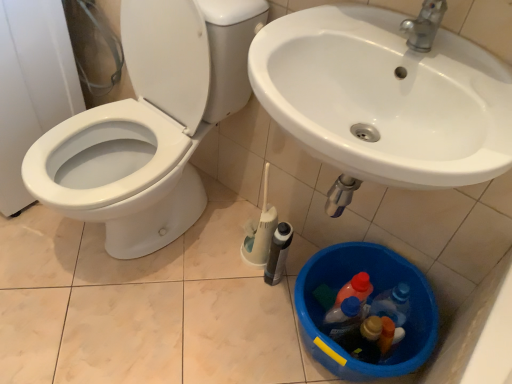
Question: Would you say white glossy toilet at left is to the left or to the right of blue plastic bucket at lower center in the picture?

Choices:
 (A) left
 (B) right

Answer: (A)

Question: Is white glossy toilet at left in front of or behind blue plastic bucket at lower center in the image?

Choices:
 (A) front
 (B) behind

Answer: (A)

Question: Is white glossy toilet at left bigger or smaller than blue plastic bucket at lower center?

Choices:
 (A) small
 (B) big

Answer: (B)

Question: From a real-world perspective, is blue plastic bucket at lower center physically located above or below white glossy toilet at left?

Choices:
 (A) below
 (B) above

Answer: (A)

Question: Is blue plastic bucket at lower center in front of or behind white glossy toilet at left in the image?

Choices:
 (A) behind
 (B) front

Answer: (A)

Question: Visually, is blue plastic bucket at lower center positioned to the left or to the right of white glossy toilet at left?

Choices:
 (A) right
 (B) left

Answer: (A)

Question: Does point (409, 316) appear closer or farther from the camera than point (73, 175)?

Choices:
 (A) closer
 (B) farther

Answer: (A)